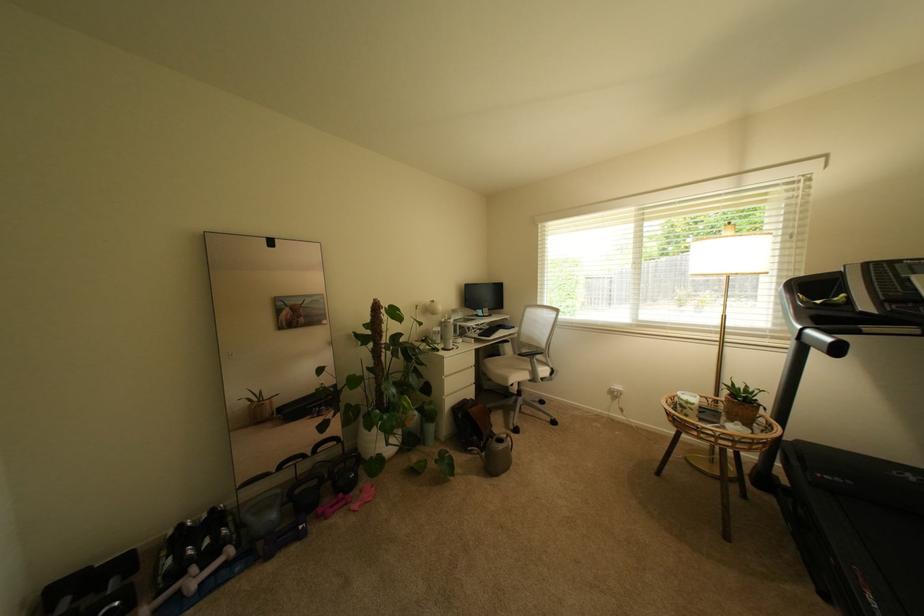
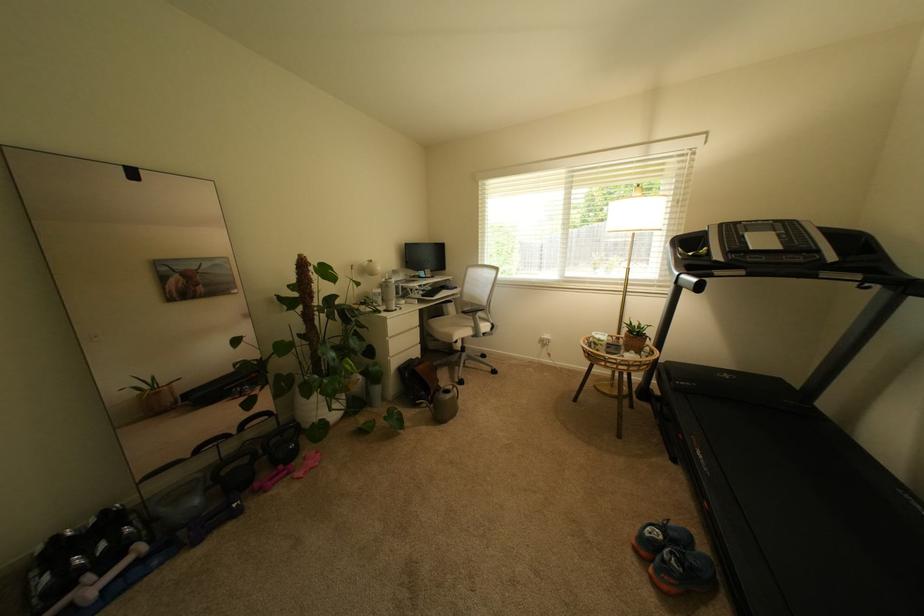
Find the pixel in the second image that matches [473,400] in the first image.

(419, 361)